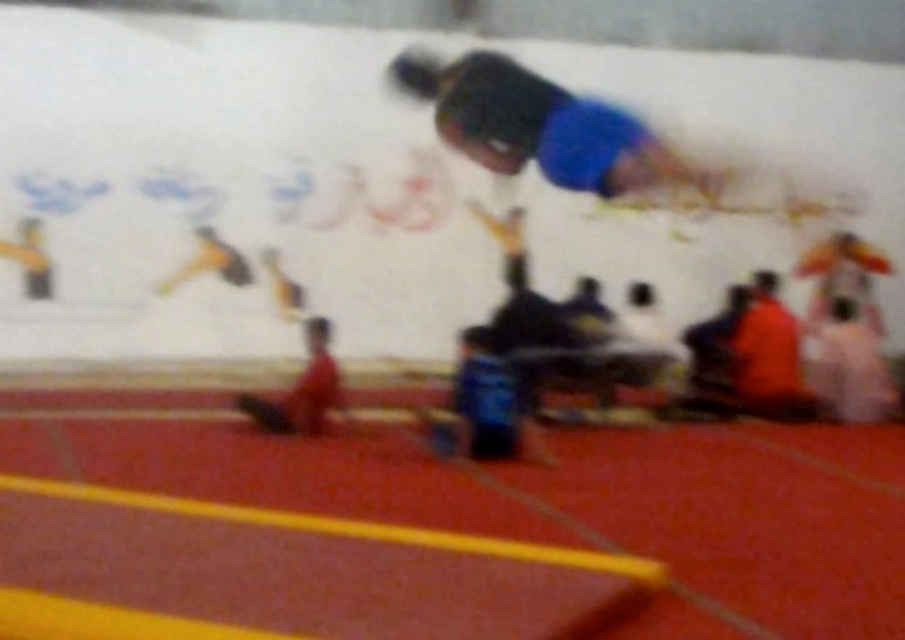
You are a photographer setting up equipment for a high jump event. You need to place a camera on the blue matte skateboard at upper center so that it can capture the orange fabric shirt at right. Given the skateboard is wider than the shirt, will the skateboard provide enough space to position the camera to focus on the shirt?

The blue matte skateboard at upper center is wider than the orange fabric shirt at right, so yes, the skateboard will provide sufficient space to position the camera to focus on the orange fabric shirt at right.

You are standing at the starting line of the track and see the blue matte skateboard at upper center. What is the 2D coordinate of the skateboard relative to the image?

The 2D coordinate of the blue matte skateboard at upper center is at point (x=543, y=128).